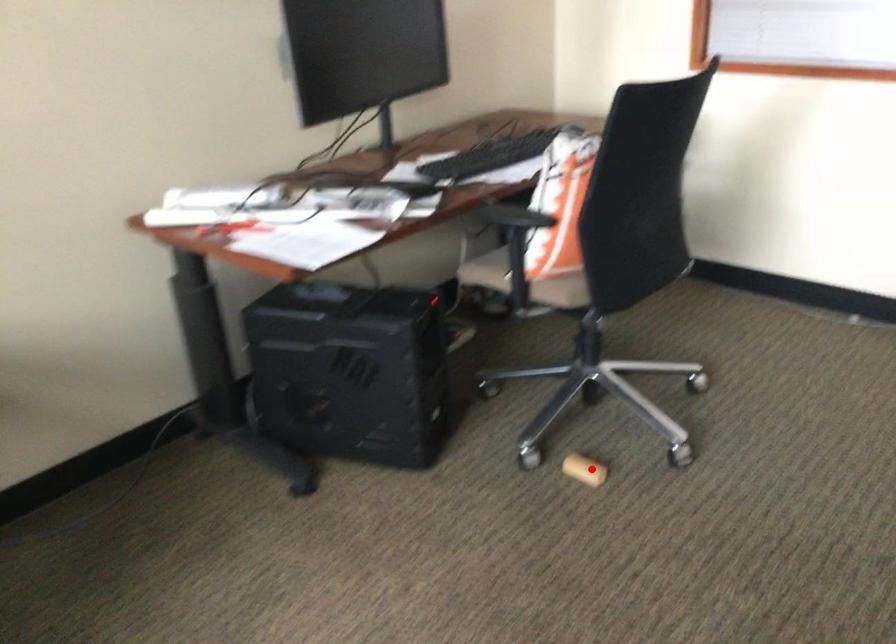
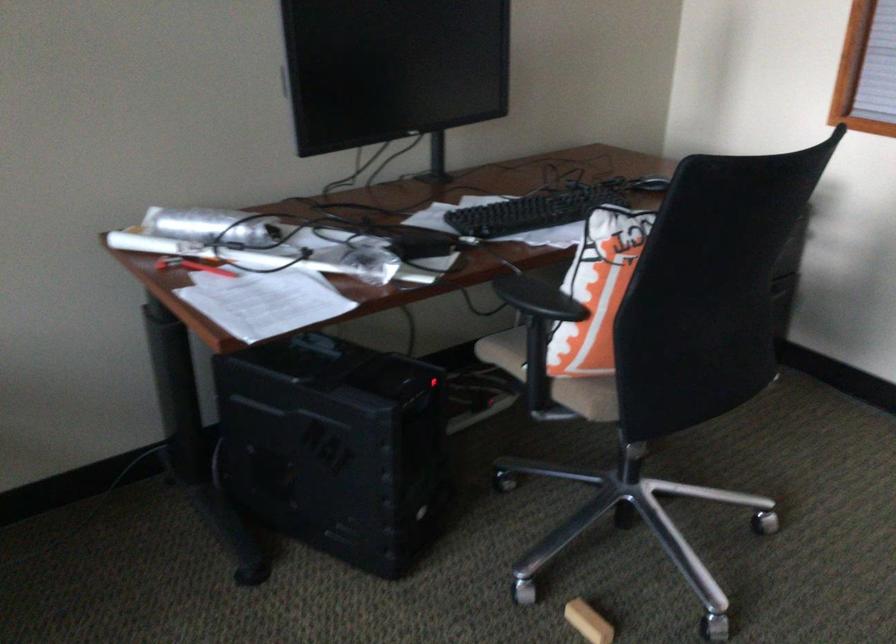
Question: A red point is marked in image1. In image2, is the corresponding 3D point closer to the camera or farther? Reply with the corresponding letter.

Choices:
 (A) The corresponding 3D point is closer.
 (B) The corresponding 3D point is farther.

Answer: (A)